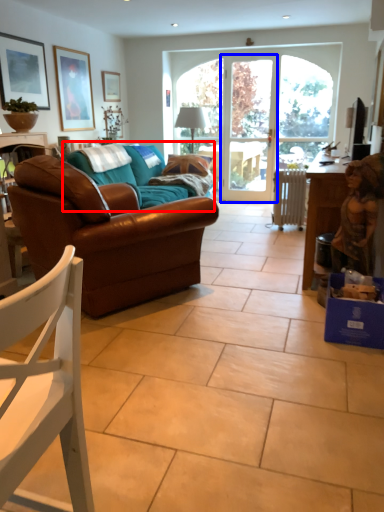
Question: Which object appears farthest to the camera in this image, couch (highlighted by a red box) or screen door (highlighted by a blue box)?

Choices:
 (A) couch
 (B) screen door

Answer: (B)